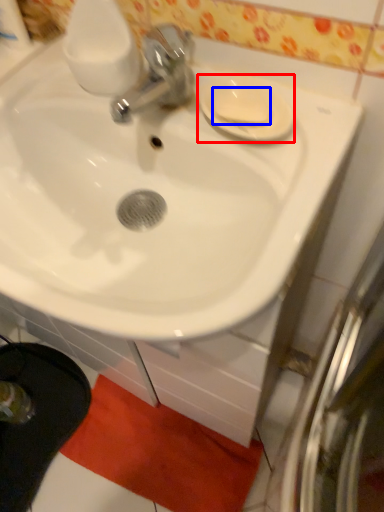
Question: Among these objects, which one is farthest to the camera, saucer (highlighted by a red box) or soap (highlighted by a blue box)?

Choices:
 (A) saucer
 (B) soap

Answer: (B)